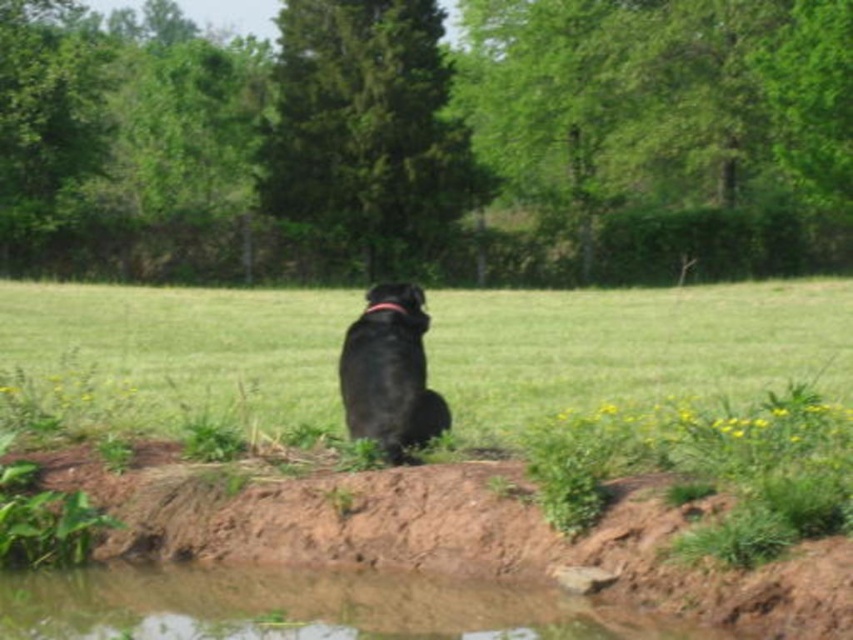
You are standing at the center of the image and want to walk to the clear water at lower center. According to the coordinates provided, in which direction should you move? Please specify the direction as either north, south, east, or west.

The clear water at lower center is located at coordinates approximately 0.948 on the x axis and 0.351 on the y axis. Since you are at the center, which would be coordinates around 0.5 on both axes, moving east would increase your x coordinate. To reach the clear water at lower center, you need to move east to increase the x value from 0.5 to 0.948 and slightly south to decrease the y value from 0.5 to 0.351. However, since the question asks for the primary direction, the main direction would be east.

You are a hiker who just arrived at this location. You need to locate the clear water at lower center to refill your water bottle. From your current position, which direction should you move relative to the black matte dog at center to reach the clear water?

The clear water at lower center is located to the left of the black matte dog at center, so you should move towards the left side relative to the black matte dog at center to reach it.

You are a gardener who wants to plant flowers in the green grass at center and clear water at lower center. Which area has a wider space for planting?

The green grass at center has a wider space for planting than the clear water at lower center because the green grass at center is wider than the clear water at lower center according to the description.